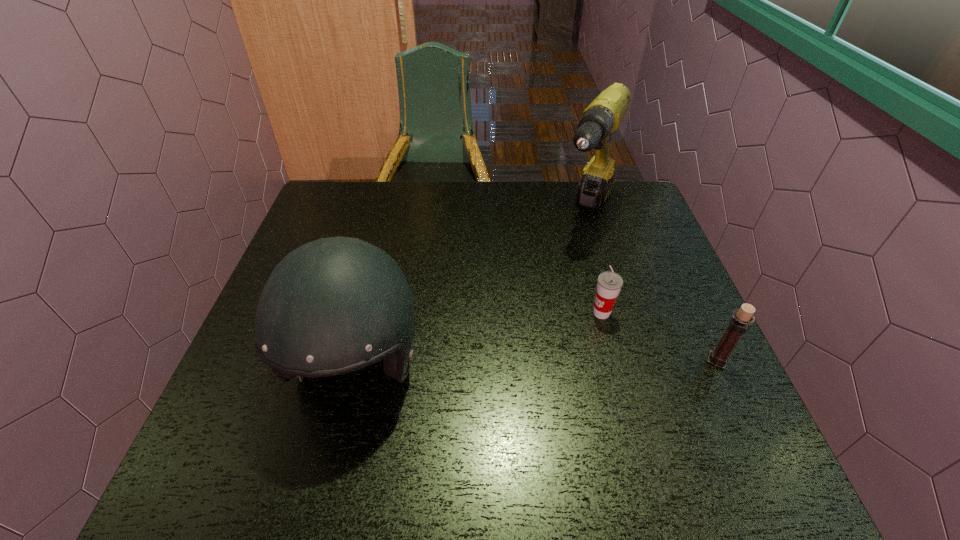
You are a GUI agent. You are given a task and a screenshot of the screen. Output one action in this format:
    pyautogui.click(x=<x>, y=<y>)
    Task: Click on the free space between the football helmet and the shortest object
    
    Given the screenshot: What is the action you would take?
    pyautogui.click(x=478, y=339)

I want to click on vacant space in between the farthest object and the rightmost object, so click(652, 287).

Where is `free space between the second tallest object and the drill`? free space between the second tallest object and the drill is located at coordinates (471, 289).

This screenshot has width=960, height=540. I want to click on free space between the candle holder and the farthest object, so click(652, 287).

What are the coordinates of `free space between the candle holder and the drill` in the screenshot? It's located at (652, 287).

Identify the location of vacant region between the leftmost object and the cup. The width and height of the screenshot is (960, 540). (478, 339).

Locate an element on the screen. The image size is (960, 540). free area in between the football helmet and the farthest object is located at coordinates (471, 289).

Select which object is the closest to the rightmost object. Please provide its 2D coordinates. Your answer should be formatted as a tuple, i.e. [(x, y)], where the tuple contains the x and y coordinates of a point satisfying the conditions above.

[(609, 284)]

Select which object appears as the second closest to the rightmost object. Please provide its 2D coordinates. Your answer should be formatted as a tuple, i.e. [(x, y)], where the tuple contains the x and y coordinates of a point satisfying the conditions above.

[(602, 117)]

Where is `free spot that satisfies the following two spatial constraints: 1. on the back side of the cup; 2. on the right side of the farthest object`? free spot that satisfies the following two spatial constraints: 1. on the back side of the cup; 2. on the right side of the farthest object is located at coordinates (575, 213).